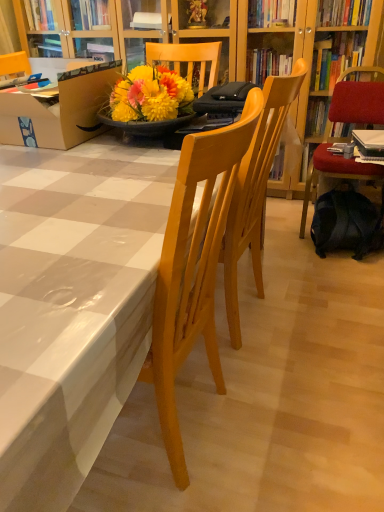
Question: Is white glossy table at center spatially inside black fabric backpack at lower right, or outside of it?

Choices:
 (A) outside
 (B) inside

Answer: (A)

Question: Considering the positions of point (51, 159) and point (369, 249), is point (51, 159) closer or farther from the camera than point (369, 249)?

Choices:
 (A) farther
 (B) closer

Answer: (B)

Question: Based on their relative distances, which object is nearer to the white glossy table at center?

Choices:
 (A) brown cardboard box at left
 (B) velvet red chair at right, the second chair when ordered from left to right
 (C) light wood chair at center, which appears as the first chair when viewed from the left
 (D) black fabric backpack at lower right

Answer: (C)

Question: Based on their relative distances, which object is farther from the light wood chair at center, the 2th chair viewed from the right?

Choices:
 (A) brown cardboard box at left
 (B) velvet red chair at right, which ranks as the 1th chair in back-to-front order
 (C) black fabric backpack at lower right
 (D) white glossy table at center

Answer: (B)